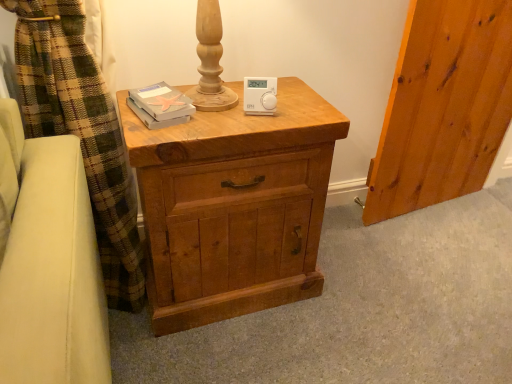
Where is `vacant space in front of white plastic thermostat at center`? This screenshot has height=384, width=512. vacant space in front of white plastic thermostat at center is located at coordinates (241, 120).